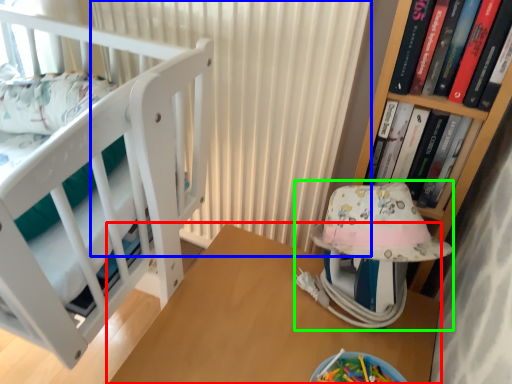
Question: Considering the real-world distances, which object is farthest from table (highlighted by a red box)? curtain (highlighted by a blue box) or baby carriage (highlighted by a green box)?

Choices:
 (A) curtain
 (B) baby carriage

Answer: (A)